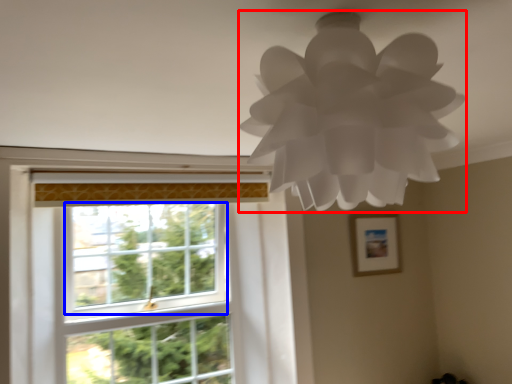
Question: Among these objects, which one is farthest to the camera, lamp (highlighted by a red box) or window screen (highlighted by a blue box)?

Choices:
 (A) lamp
 (B) window screen

Answer: (B)